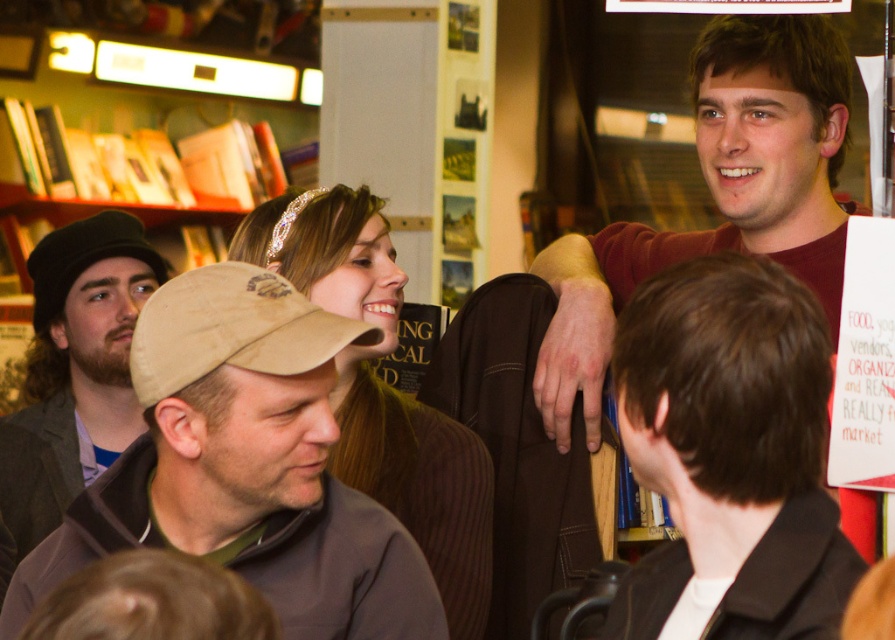
Between brown woolen cap at left and tan fabric baseball cap at center, which one has less height?

With less height is tan fabric baseball cap at center.

Which is more to the right, brown woolen cap at left or tan fabric baseball cap at center?

Positioned to the right is tan fabric baseball cap at center.

You are a GUI agent. You are given a task and a screenshot of the screen. Output one action in this format:
    pyautogui.click(x=<x>, y=<y>)
    Task: Click on the brown woolen cap at left
    The width and height of the screenshot is (895, 640).
    Given the screenshot: What is the action you would take?
    pyautogui.click(x=75, y=369)

Between point (662, 474) and point (358, 333), which one is positioned in front?

Point (662, 474)

Where is `black matte jacket at upper right`? This screenshot has height=640, width=895. black matte jacket at upper right is located at coordinates (731, 451).

At what (x,y) coordinates should I click in order to perform the action: click on black matte jacket at upper right. Please return your answer as a coordinate pair (x, y). The height and width of the screenshot is (640, 895). Looking at the image, I should click on (731, 451).

Does shiny silver headband at upper center lie in front of brown woolen cap at left?

Yes, shiny silver headband at upper center is closer to the viewer.

Who is positioned more to the left, shiny silver headband at upper center or brown woolen cap at left?

Positioned to the left is brown woolen cap at left.

At what (x,y) coordinates should I click in order to perform the action: click on shiny silver headband at upper center. Please return your answer as a coordinate pair (x, y). Looking at the image, I should click on (384, 392).